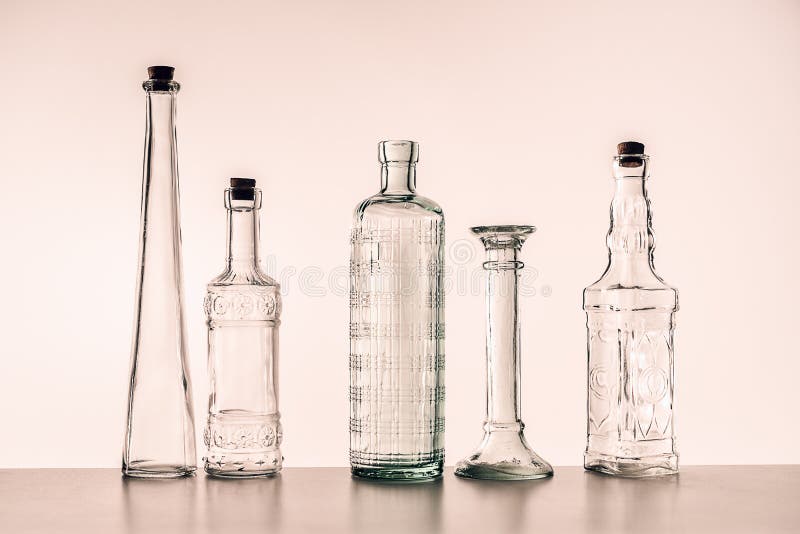
Find the location of a particular element. This screenshot has height=534, width=800. glass bottle with design imprinted during creation is located at coordinates 662,389, 394,370, 238,308.